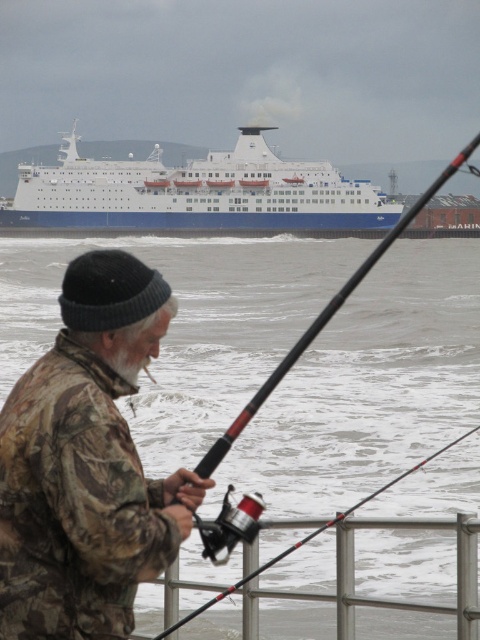
You are a photographer trying to capture the cruise ship in the background. You notice the white frothy water at lower center and the white matte ship at upper center. Which object in the scene is bigger and might block your view of the ship?

The white frothy water at lower center is larger in size than the white matte ship at upper center, so it might block your view of the ship.

You are an observer standing in front of the scene. You see the camouflage fabric jacket at left and the camouflage fabric fishing pole at center. Which object is located more to the left?

The camouflage fabric jacket at left is positioned on the left side of camouflage fabric fishing pole at center, so the camouflage fabric jacket at left is more to the left.